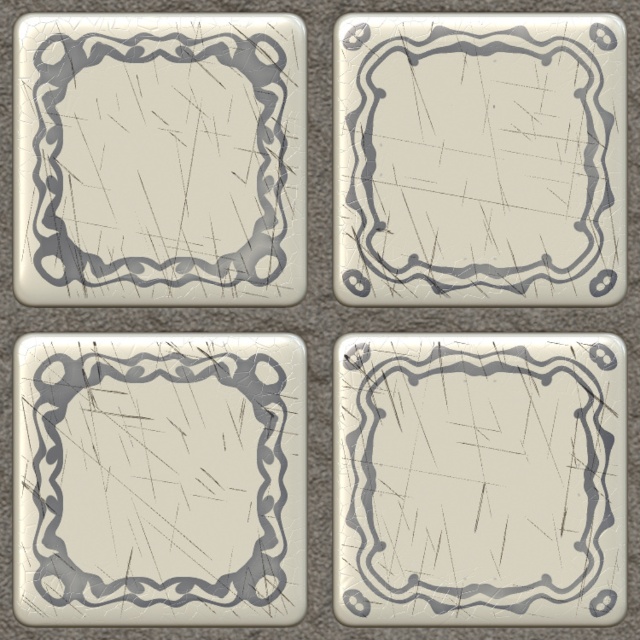
You are a contractor installing these tiles on a bathroom wall. You need to place a new matte silver frame at upper left and a matte silver frame at bottom left. Given that the space between them must be exactly 3 inches for proper alignment, will the current spacing between the existing frames meet this requirement?

The matte silver frame at upper left and matte silver frame at bottom left are 2.75 inches apart. Since the required spacing is 3 inches, the current distance is insufficient by 0.25 inches.

You are an interior designer assessing the placement of a new decorative item in a room. The room has four identical square tiles arranged in a 2x2 grid. You need to place a small vase exactly at point (x=157, y=160). Which tile should you place the vase on?

The point (x=157, y=160) corresponds to the matte silver frame at upper left tile, so you should place the vase on the matte silver frame at upper left tile.